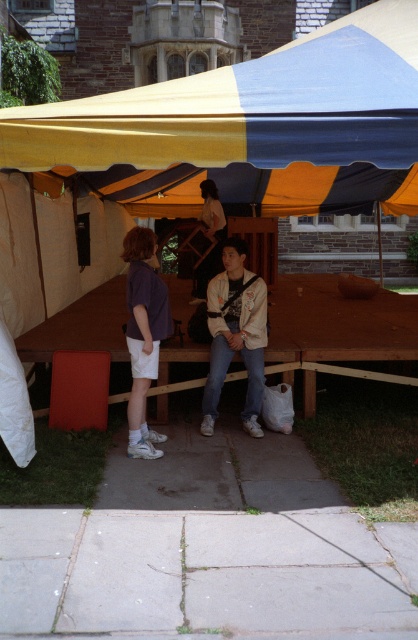
Question: Which point is closer to the camera taking this photo?

Choices:
 (A) (380, 20)
 (B) (201, 220)

Answer: (A)

Question: Can you confirm if brown wooden picnic table at center is positioned to the left of matte white shirt at center?

Choices:
 (A) no
 (B) yes

Answer: (B)

Question: Can you confirm if yellow fabric canopy at upper center is smaller than matte white shirt at center?

Choices:
 (A) no
 (B) yes

Answer: (A)

Question: Does brown wooden picnic table at center appear on the right side of purple fabric shirt at center?

Choices:
 (A) yes
 (B) no

Answer: (B)

Question: Which object is positioned closest to the purple fabric shirt at center?

Choices:
 (A) yellow fabric tent at center
 (B) brown wooden picnic table at center

Answer: (B)

Question: Which point is closer to the camera?

Choices:
 (A) (56, 116)
 (B) (216, 221)
 (C) (250, 170)

Answer: (A)